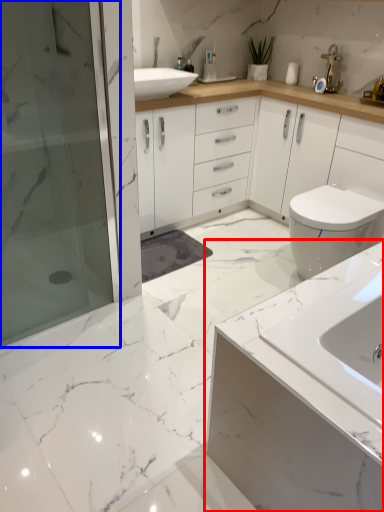
Question: Which object is closer to the camera taking this photo, bathroom cabinet (highlighted by a red box) or shower door (highlighted by a blue box)?

Choices:
 (A) bathroom cabinet
 (B) shower door

Answer: (A)